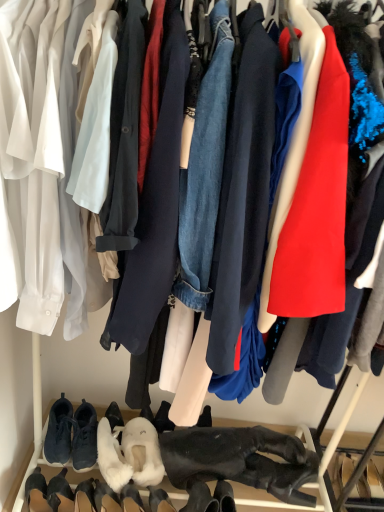
Question: Which direction should I rotate to face white fluffy slippers at lower center, arranged as the fourth footwear when viewed from the right, — up or down?

Choices:
 (A) down
 (B) up

Answer: (A)

Question: Which direction should I rotate to look at white fluffy boot at lower center, arranged as the 3th footwear when viewed from the right?

Choices:
 (A) left
 (B) right

Answer: (A)

Question: Is dark blue suede sneakers at lower left, which appears as the seventh footwear when viewed from the right, beside white suede boot at lower left, the 6th footwear from the right?

Choices:
 (A) yes
 (B) no

Answer: (B)

Question: Is dark blue suede sneakers at lower left, which is counted as the second footwear, starting from the left, closer to camera compared to white suede boot at lower left, the third footwear from the left?

Choices:
 (A) no
 (B) yes

Answer: (A)

Question: Does dark blue suede sneakers at lower left, which appears as the seventh footwear when viewed from the right, have a lesser height compared to white suede boot at lower left, the 6th footwear from the right?

Choices:
 (A) no
 (B) yes

Answer: (B)

Question: Would you say dark blue suede sneakers at lower left, which is counted as the second footwear, starting from the left, contains white suede boot at lower left, the 6th footwear from the right?

Choices:
 (A) yes
 (B) no

Answer: (B)

Question: From a real-world perspective, is dark blue suede sneakers at lower left, which appears as the seventh footwear when viewed from the right, positioned under white suede boot at lower left, the third footwear from the left, based on gravity?

Choices:
 (A) no
 (B) yes

Answer: (A)

Question: From the image's perspective, does dark blue suede sneakers at lower left, which is counted as the second footwear, starting from the left, appear lower than white suede boot at lower left, the third footwear from the left?

Choices:
 (A) yes
 (B) no

Answer: (B)

Question: Is white fluffy boot at lower center, the sixth footwear from the left, taller than white fluffy slippers at lower center, which is the 7th footwear from left to right?

Choices:
 (A) yes
 (B) no

Answer: (A)

Question: From a real-world perspective, is white fluffy boot at lower center, arranged as the 3th footwear when viewed from the right, physically below white fluffy slippers at lower center, the second footwear viewed from the right?

Choices:
 (A) yes
 (B) no

Answer: (A)

Question: Is white fluffy boot at lower center, the sixth footwear from the left, smaller than white fluffy slippers at lower center, the second footwear viewed from the right?

Choices:
 (A) no
 (B) yes

Answer: (B)

Question: Are white fluffy boot at lower center, arranged as the 3th footwear when viewed from the right, and white fluffy slippers at lower center, which is the 7th footwear from left to right, beside each other?

Choices:
 (A) no
 (B) yes

Answer: (A)

Question: Does white fluffy boot at lower center, the sixth footwear from the left, come behind white fluffy slippers at lower center, which is the 7th footwear from left to right?

Choices:
 (A) no
 (B) yes

Answer: (A)

Question: Is white fluffy slippers at lower center, the second footwear viewed from the right, a part of white fluffy boot at lower center, arranged as the 3th footwear when viewed from the right?

Choices:
 (A) no
 (B) yes

Answer: (A)

Question: Does black suede boot at lower left, which is the eighth footwear in right-to-left order, contain dark blue suede sneakers at lower left, which is counted as the second footwear, starting from the left?

Choices:
 (A) no
 (B) yes

Answer: (A)